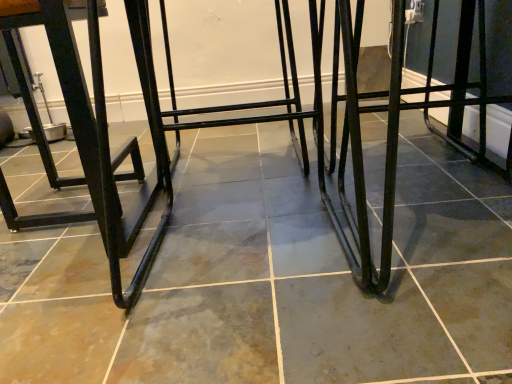
Question: From a real-world perspective, is black metal frame at left above or below black metal step stool at center?

Choices:
 (A) below
 (B) above

Answer: (B)

Question: Would you say black metal frame at left is to the left or to the right of black metal step stool at center in the picture?

Choices:
 (A) left
 (B) right

Answer: (A)

Question: Is black metal frame at left taller or shorter than black metal step stool at center?

Choices:
 (A) tall
 (B) short

Answer: (A)

Question: From a real-world perspective, is black metal step stool at center positioned above or below black metal frame at left?

Choices:
 (A) above
 (B) below

Answer: (B)

Question: Which is correct: black metal step stool at center is inside black metal frame at left, or outside of it?

Choices:
 (A) inside
 (B) outside

Answer: (B)

Question: From the image's perspective, is black metal step stool at center located above or below black metal frame at left?

Choices:
 (A) below
 (B) above

Answer: (A)

Question: Is black metal step stool at center taller or shorter than black metal frame at left?

Choices:
 (A) tall
 (B) short

Answer: (B)